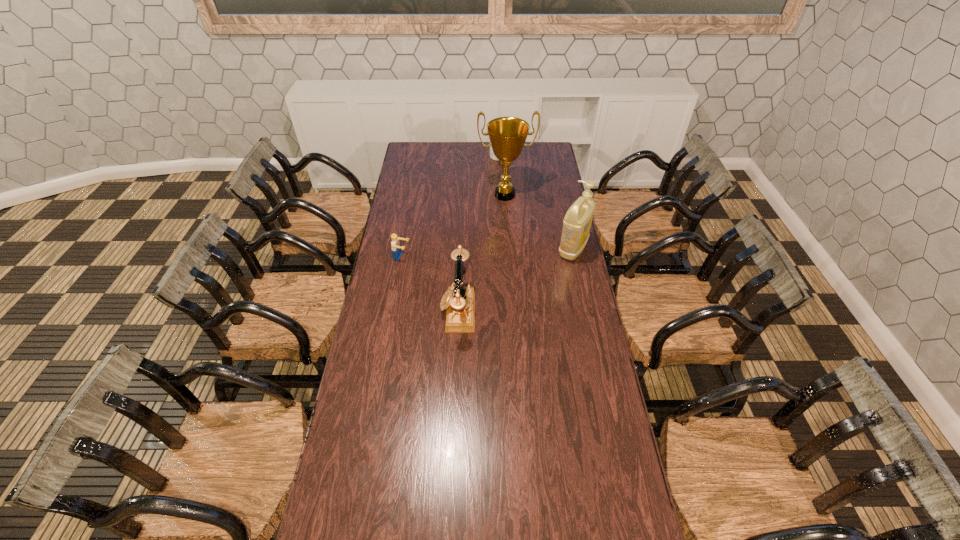
I want to click on telephone, so pyautogui.click(x=459, y=301).

You are a GUI agent. You are given a task and a screenshot of the screen. Output one action in this format:
    pyautogui.click(x=<x>, y=<y>)
    Task: Click on the fourth object from right to left
    The image size is (960, 540).
    Given the screenshot: What is the action you would take?
    pyautogui.click(x=459, y=301)

Image resolution: width=960 pixels, height=540 pixels. What are the coordinates of `detergent` in the screenshot? It's located at (577, 222).

Where is `the fourth shortest object`? The height and width of the screenshot is (540, 960). the fourth shortest object is located at coordinates (577, 222).

At what (x,y) coordinates should I click in order to perform the action: click on the farthest object. Please return your answer as a coordinate pair (x, y). The width and height of the screenshot is (960, 540). Looking at the image, I should click on (492, 156).

Image resolution: width=960 pixels, height=540 pixels. Identify the location of Lego. [395, 244].

You are a GUI agent. You are given a task and a screenshot of the screen. Output one action in this format:
    pyautogui.click(x=<x>, y=<y>)
    Task: Click on the second farthest object
    
    Given the screenshot: What is the action you would take?
    pyautogui.click(x=507, y=135)

You are a GUI agent. You are given a task and a screenshot of the screen. Output one action in this format:
    pyautogui.click(x=<x>, y=<y>)
    Task: Click on the tallest object
    The width and height of the screenshot is (960, 540).
    Given the screenshot: What is the action you would take?
    pyautogui.click(x=507, y=135)

The image size is (960, 540). I want to click on vacant space located on the dial of the nearest object, so click(421, 310).

The height and width of the screenshot is (540, 960). I want to click on vacant space located 0.110m on the dial of the nearest object, so click(414, 310).